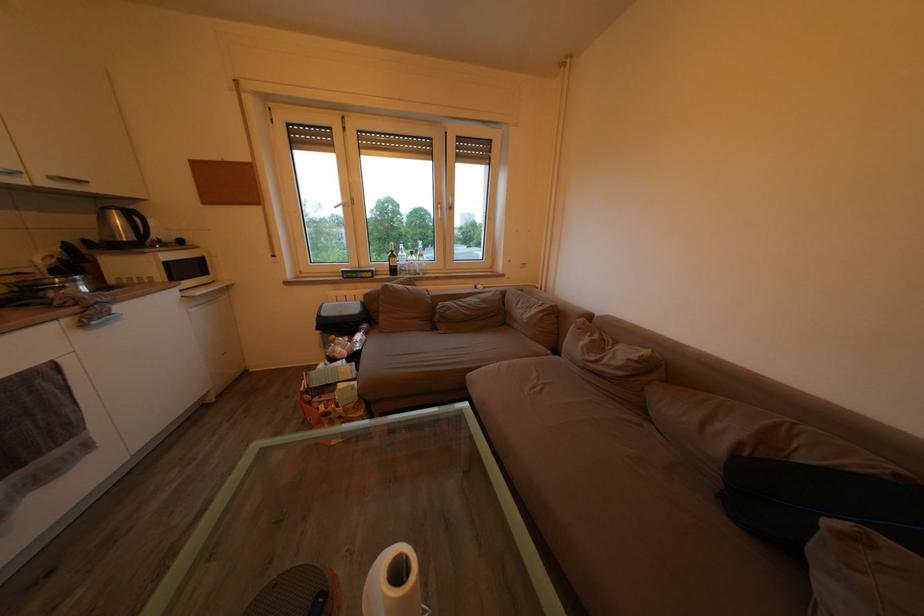
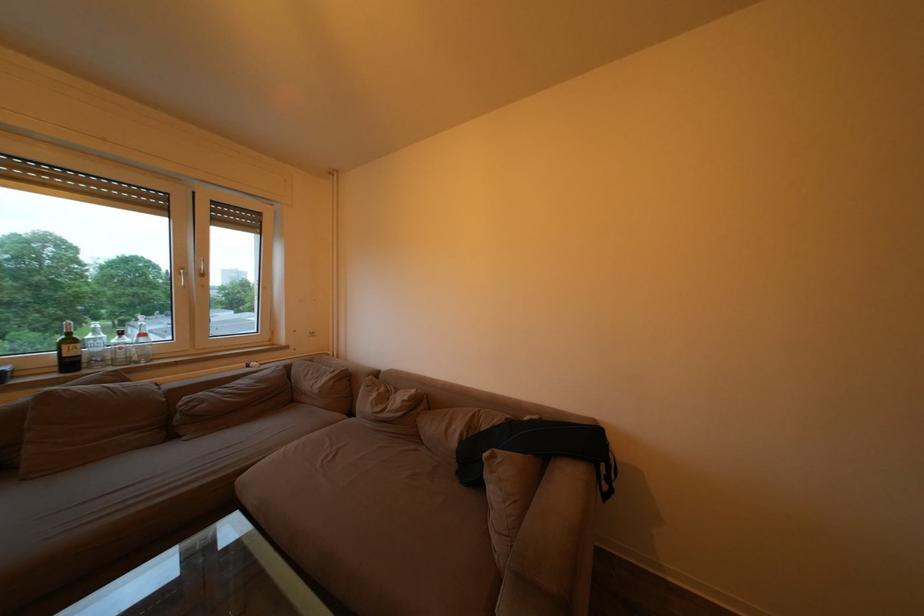
The point at (603,342) is marked in the first image. Where is the corresponding point in the second image?

(390, 395)